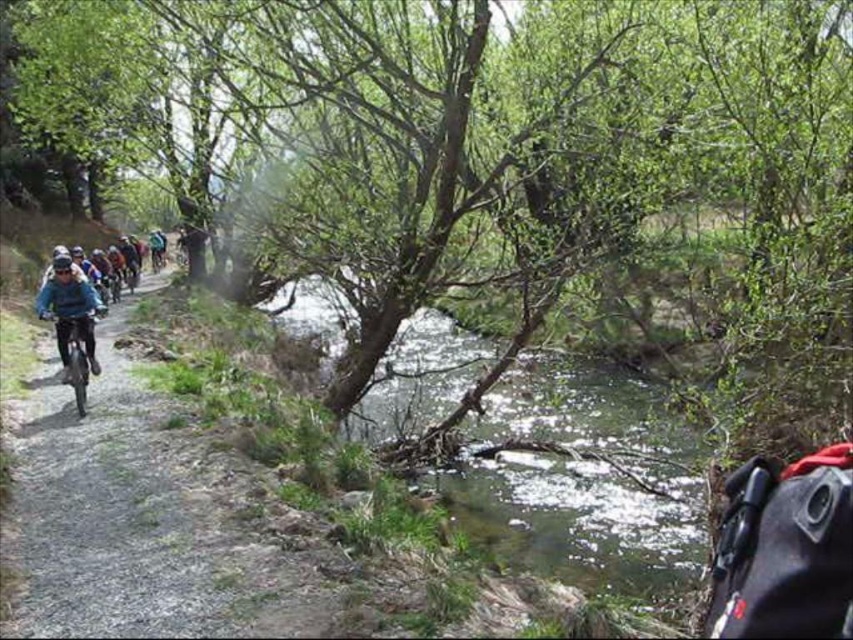
Looking at this image, you are a cyclist approaching the path and want to know which is wider between the green leafy tree at upper center and the green leafy creek at center. Can you determine which one is wider?

The green leafy tree at upper center is wider than the green leafy creek at center according to the description.

You are a cyclist approaching the green leafy tree at upper center and the green leafy creek at center along the gravel path. Which object will you encounter first as you continue moving forward?

The green leafy tree at upper center is in front of the green leafy creek at center, so you will encounter the green leafy tree at upper center first.